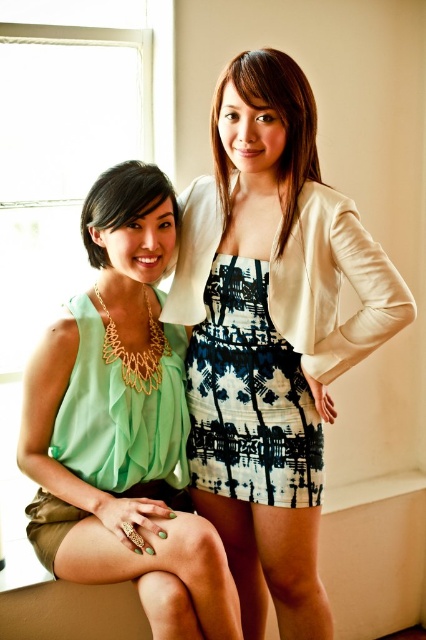
In the scene shown: You are standing in the room and want to take a photo of the two people. The camera you are using has a focal length of 50mm and a sensor size of 24mm x 36mm. If you want to ensure both subjects are in focus, what is the minimum distance you should be from the point at coordinates point (213, 465)?

The minimum distance you should be from the point at coordinates point (213, 465) is 1.68 meters, as this is the distance between the viewer and the point according to the description.

Consider the image. You are a photographer setting up for a photoshoot and need to arrange two outfits for a client. The client wants the mint chiffon dress at lower left and the matte beige blazer at center to be visible in the frame. Based on their current positions, which outfit is closer to the left side of the camera view?

The mint chiffon dress at lower left is positioned on the left side of the matte beige blazer at center, so it is closer to the left side of the camera view.

You are a fashion designer analyzing the clothing items in the image. Which clothing item, the matte green blouse at left or the mint chiffon dress at lower left, has a larger size?

The matte green blouse at left is larger in size than the mint chiffon dress at lower left.